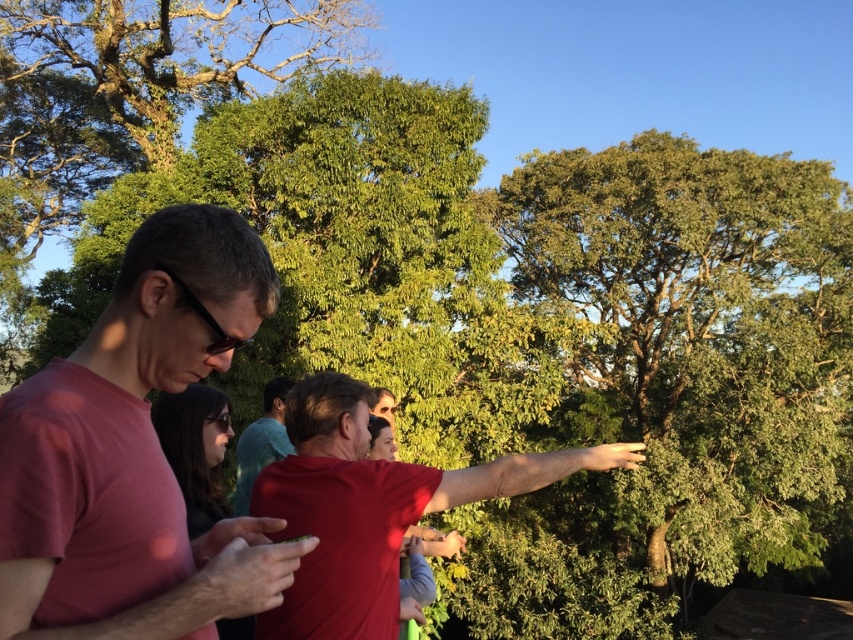
You are a photographer trying to capture both the red matte shirt at center and the teal fabric shirt at center in a single shot. Based on their sizes in the image, which one should you focus on first to ensure they are both in frame?

The red matte shirt at center is much taller than the teal fabric shirt at center, so focusing on the red matte shirt at center first would ensure both are in frame since it occupies more space.

You are organizing a group photo and need to ensure that the two people at the center have enough space between them. Given that the matte red shirt at center and the teal fabric shirt at center are standing close by each other, can you determine if there is enough space between them based on their widths?

The matte red shirt at center is wider than the teal fabric shirt at center, but the description does not provide specific measurements of the distance between them. Therefore, it is unclear if there is enough space between them based solely on their widths.